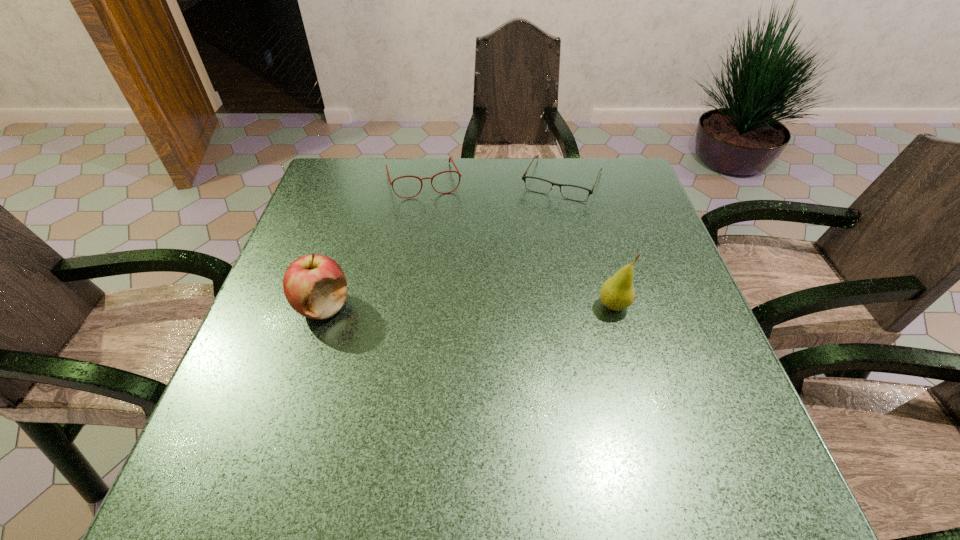
In the image, there is a desktop. Where is `vacant space at the right edge`? The height and width of the screenshot is (540, 960). vacant space at the right edge is located at coordinates (648, 353).

I want to click on vacant space at the far left corner, so click(372, 186).

You are a GUI agent. You are given a task and a screenshot of the screen. Output one action in this format:
    pyautogui.click(x=<x>, y=<y>)
    Task: Click on the vacant space at the far right corner of the desktop
    
    Given the screenshot: What is the action you would take?
    (636, 181)

In the image, there is a desktop. Where is `free region at the near right corner`? free region at the near right corner is located at coordinates (676, 396).

Where is `vacant space that is in between the pear and the shorter spectacles`? The image size is (960, 540). vacant space that is in between the pear and the shorter spectacles is located at coordinates (588, 243).

In order to click on free space between the shortest object and the apple in this screenshot , I will do `click(443, 243)`.

Find the location of a particular element. The width and height of the screenshot is (960, 540). free space between the right spectacles and the apple is located at coordinates (443, 243).

I want to click on vacant region between the shorter spectacles and the apple, so click(x=443, y=243).

The image size is (960, 540). I want to click on vacant region between the apple and the taller spectacles, so click(373, 244).

The width and height of the screenshot is (960, 540). Identify the location of free spot between the apple and the pear. (468, 306).